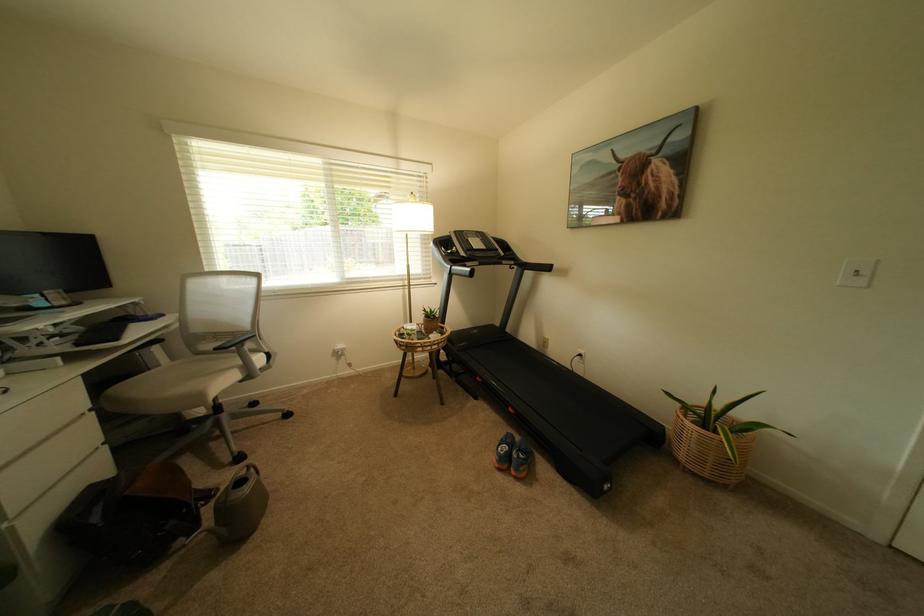
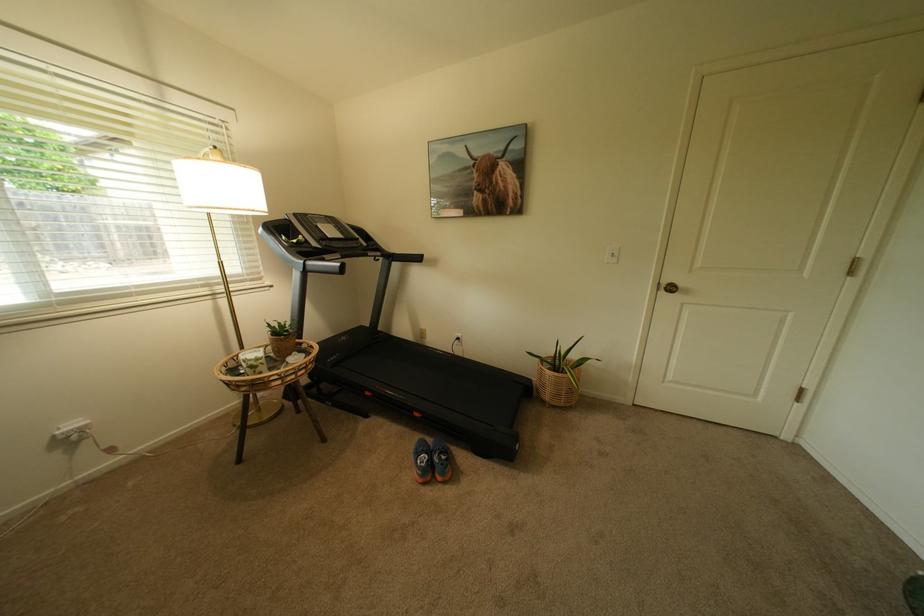
Question: The camera is either moving clockwise (left) or counter-clockwise (right) around the object. The first image is from the beginning of the video and the second image is from the end. Is the camera moving left or right when shooting the video?

Choices:
 (A) Left
 (B) Right

Answer: (A)